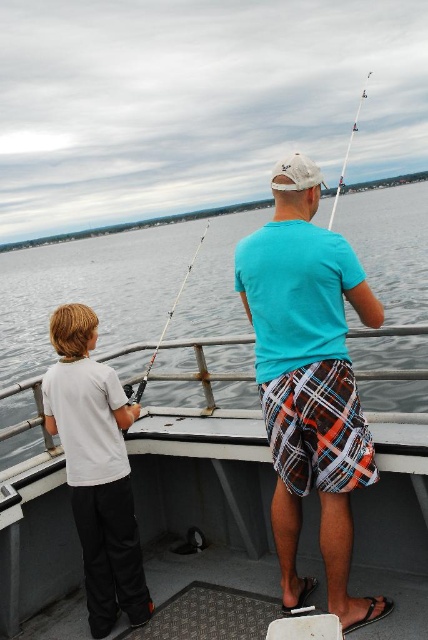
Question: Which object is positioned farthest from the white plastic fishing pole at upper right?

Choices:
 (A) white matte shirt at left
 (B) clear water at center
 (C) metallic gray boat at center
 (D) teal cotton t-shirt at center

Answer: (C)

Question: Can you confirm if metallic gray boat at center is thinner than clear plastic fishing pole at center?

Choices:
 (A) no
 (B) yes

Answer: (B)

Question: Which point is farther to the camera?

Choices:
 (A) metallic gray boat at center
 (B) clear water at center
 (C) white plastic fishing pole at upper right

Answer: (C)

Question: Where is metallic gray boat at center located in relation to teal cotton t-shirt at center in the image?

Choices:
 (A) below
 (B) above

Answer: (A)

Question: Is metallic gray boat at center to the right of clear plastic fishing pole at center from the viewer's perspective?

Choices:
 (A) yes
 (B) no

Answer: (A)

Question: Which is nearer to the teal cotton t-shirt at center?

Choices:
 (A) metallic gray boat at center
 (B) clear plastic fishing pole at center
 (C) white matte shirt at left

Answer: (A)